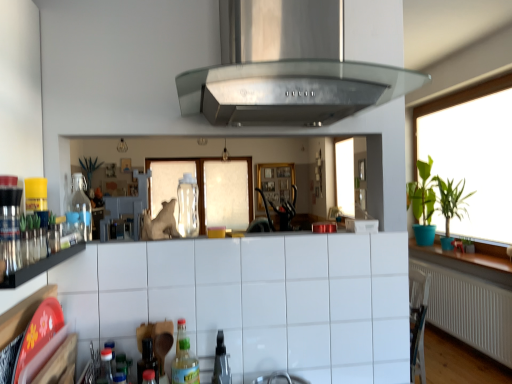
Question: Is green matte plant at right, positioned as the first plant in front-to-back order, surrounded by green leafy plant at right, which is counted as the 1th plant, starting from the back?

Choices:
 (A) no
 (B) yes

Answer: (A)

Question: Considering the relative sizes of green leafy plant at right, positioned as the 2th plant in front-to-back order, and green matte plant at right, positioned as the first plant in front-to-back order, in the image provided, is green leafy plant at right, positioned as the 2th plant in front-to-back order, taller than green matte plant at right, positioned as the first plant in front-to-back order,?

Choices:
 (A) no
 (B) yes

Answer: (A)

Question: Can you confirm if green leafy plant at right, which is counted as the 1th plant, starting from the back, is thinner than green matte plant at right, positioned as the second plant in back-to-front order?

Choices:
 (A) yes
 (B) no

Answer: (A)

Question: From a real-world perspective, is green leafy plant at right, which is counted as the 1th plant, starting from the back, below green matte plant at right, positioned as the second plant in back-to-front order?

Choices:
 (A) no
 (B) yes

Answer: (B)

Question: From a real-world perspective, does green leafy plant at right, which is counted as the 1th plant, starting from the back, stand above green matte plant at right, positioned as the first plant in front-to-back order?

Choices:
 (A) no
 (B) yes

Answer: (A)

Question: From the image's perspective, is white tile cabinetry at lower center above or below green leafy plant at right, positioned as the 2th plant in front-to-back order?

Choices:
 (A) below
 (B) above

Answer: (B)

Question: Is point (128, 322) closer or farther from the camera than point (464, 246)?

Choices:
 (A) farther
 (B) closer

Answer: (B)

Question: From a real-world perspective, is white tile cabinetry at lower center positioned above or below green leafy plant at right, which is counted as the 1th plant, starting from the back?

Choices:
 (A) below
 (B) above

Answer: (B)

Question: Is white tile cabinetry at lower center bigger or smaller than green leafy plant at right, positioned as the 2th plant in front-to-back order?

Choices:
 (A) big
 (B) small

Answer: (A)

Question: In terms of height, does stainless steel exhaust hood at center look taller or shorter compared to clear glass bottle at left, the second bottle ordered from the bottom?

Choices:
 (A) tall
 (B) short

Answer: (A)

Question: Considering the positions of stainless steel exhaust hood at center and clear glass bottle at left, the 2th bottle positioned from the top, in the image, is stainless steel exhaust hood at center bigger or smaller than clear glass bottle at left, the 2th bottle positioned from the top,?

Choices:
 (A) big
 (B) small

Answer: (A)

Question: Would you say stainless steel exhaust hood at center is to the left or to the right of clear glass bottle at left, the first bottle from the left, in the picture?

Choices:
 (A) left
 (B) right

Answer: (B)

Question: From the image's perspective, relative to clear glass bottle at left, the 2th bottle positioned from the top, is stainless steel exhaust hood at center above or below?

Choices:
 (A) below
 (B) above

Answer: (B)

Question: Is point (417, 228) positioned closer to the camera than point (194, 370)?

Choices:
 (A) closer
 (B) farther

Answer: (B)

Question: In the image, is green matte plant at right, positioned as the first plant in front-to-back order, positioned in front of or behind translucent plastic bottle at lower center, placed as the 1th bottle when sorted from bottom to top?

Choices:
 (A) behind
 (B) front

Answer: (A)